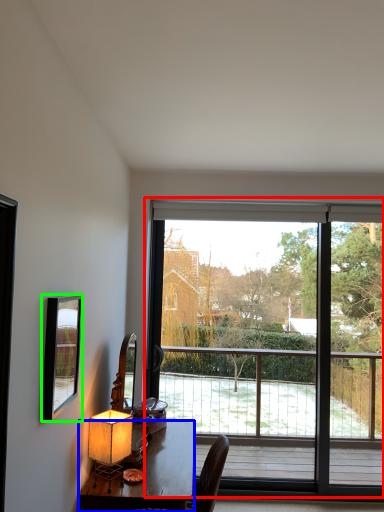
Question: Considering the real-world distances, which object is closest to window (highlighted by a red box)? desk (highlighted by a blue box) or mirror (highlighted by a green box).

Choices:
 (A) desk
 (B) mirror

Answer: (A)